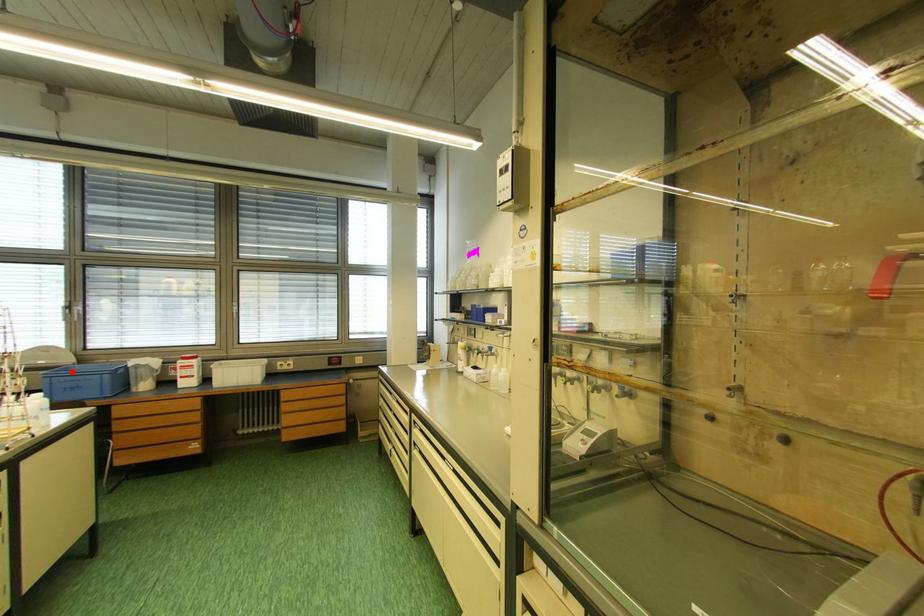
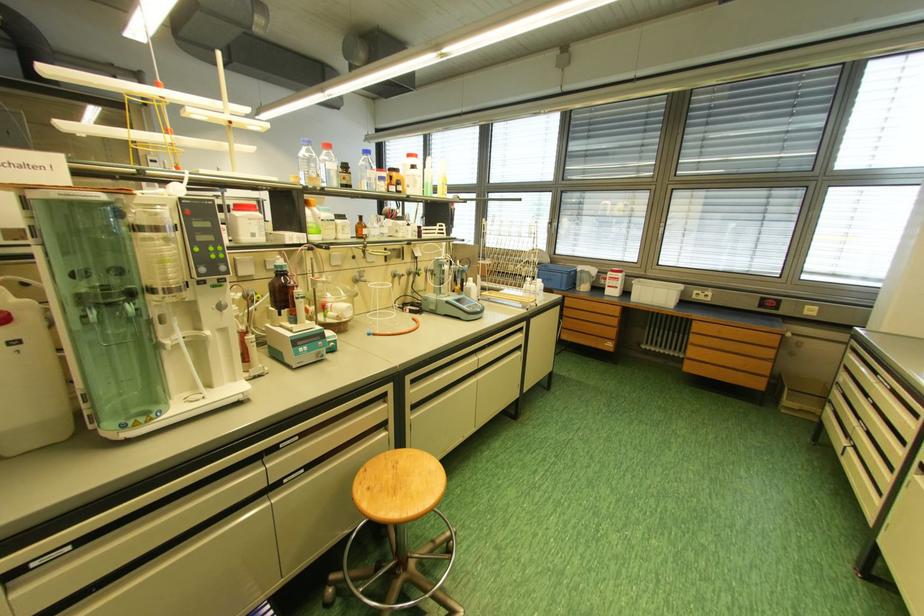
The point at the highlighted location is marked in the first image. Where is the corresponding point in the second image?

(551, 269)